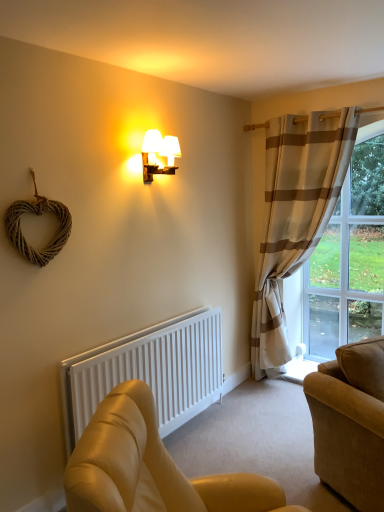
Where is `free spot to the right of white matte radiator at lower left`? Image resolution: width=384 pixels, height=512 pixels. free spot to the right of white matte radiator at lower left is located at coordinates (240, 441).